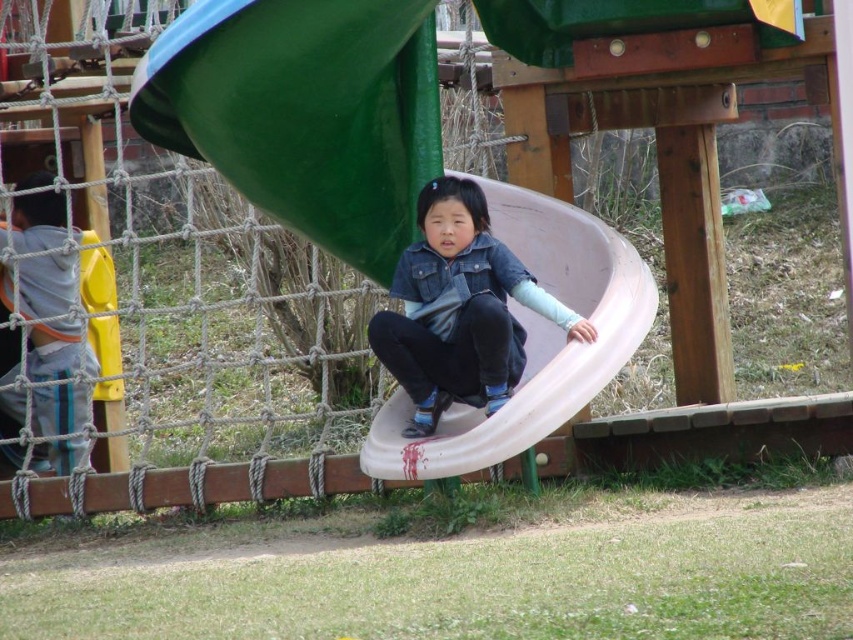
You are standing in the playground and want to know which of the two points, point (393, 93) or point (480, 362), is closer to you. Can you determine this based on their positions?

Point (393, 93) is further to the camera than point (480, 362), so the point closer to you is point (480, 362).

You are a parent trying to decide which toy to buy for your child. You see a matte blue slide at center and a gray hoodie at left in a catalog. Based on their sizes, which one would you choose if you want the bigger item?

The gray hoodie at left is bigger than the matte blue slide at center, so you should choose the gray hoodie at left if you want the bigger item.

You are standing at the playground and see the white plastic slide at center and the gray hoodie at left. Which object is located to the right of the other?

The white plastic slide at center is positioned on the right side of gray hoodie at left.